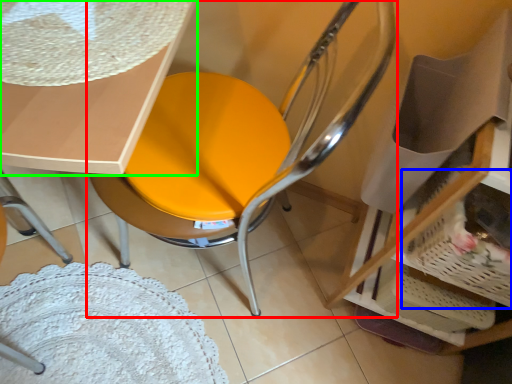
Question: Based on their relative distances, which object is nearer to chair (highlighted by a red box)? Choose from basket (highlighted by a blue box) and table (highlighted by a green box).

Choices:
 (A) basket
 (B) table

Answer: (B)